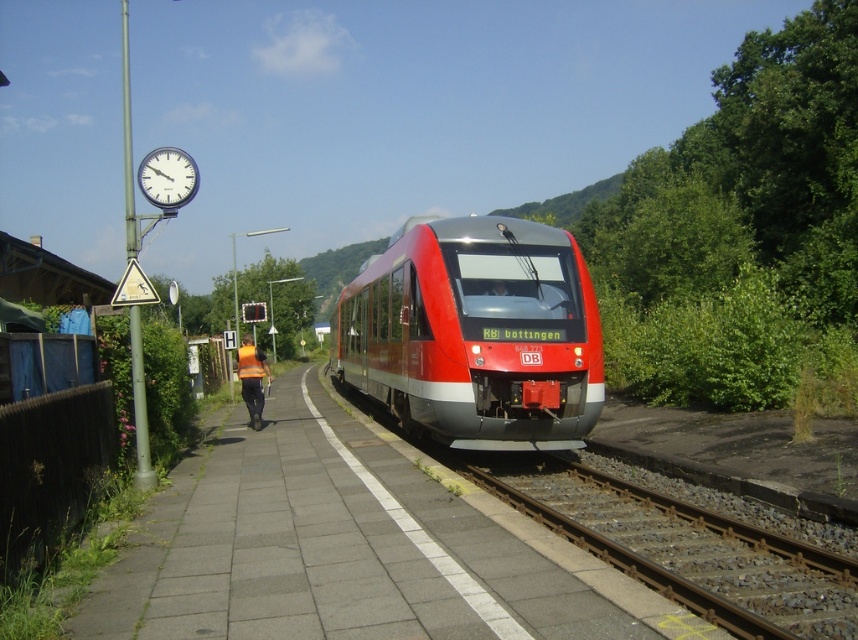
Question: Does red metallic train at center appear under reflective orange vest at center?

Choices:
 (A) yes
 (B) no

Answer: (B)

Question: Which is farther from the brown gravel train track at lower center?

Choices:
 (A) reflective orange vest at center
 (B) red metallic train at center

Answer: (A)

Question: Which object is positioned closest to the brown gravel train track at lower center?

Choices:
 (A) reflective orange vest at center
 (B) red metallic train at center

Answer: (B)

Question: Which of these objects is positioned closest to the reflective orange vest at center?

Choices:
 (A) brown gravel train track at lower center
 (B) red metallic train at center

Answer: (B)

Question: Does red metallic train at center lie behind brown gravel train track at lower center?

Choices:
 (A) yes
 (B) no

Answer: (A)

Question: In this image, where is brown gravel train track at lower center located relative to reflective orange vest at center?

Choices:
 (A) left
 (B) right

Answer: (B)